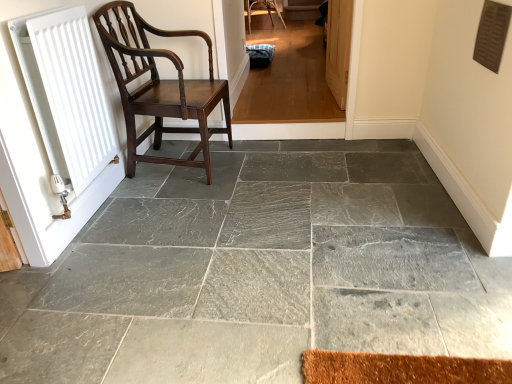
Question: Considering the positions of dark wood chair at left and gray stone floor at center in the image, is dark wood chair at left bigger or smaller than gray stone floor at center?

Choices:
 (A) big
 (B) small

Answer: (A)

Question: Considering the positions of dark wood chair at left and gray stone floor at center in the image, is dark wood chair at left wider or thinner than gray stone floor at center?

Choices:
 (A) wide
 (B) thin

Answer: (B)

Question: Which object is positioned farthest from the wooden screen door at upper right?

Choices:
 (A) white matte radiator at left
 (B) gray stone floor at center
 (C) dark wood chair at left

Answer: (A)

Question: Which object is the closest to the dark wood chair at left?

Choices:
 (A) wooden screen door at upper right
 (B) gray stone floor at center
 (C) white matte radiator at left

Answer: (C)